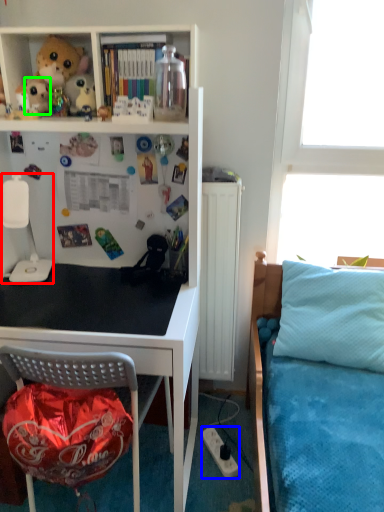
Question: Which object is positioned farthest from lamp (highlighted by a red box)? Select from power outlet (highlighted by a blue box) and toy (highlighted by a green box).

Choices:
 (A) power outlet
 (B) toy

Answer: (A)